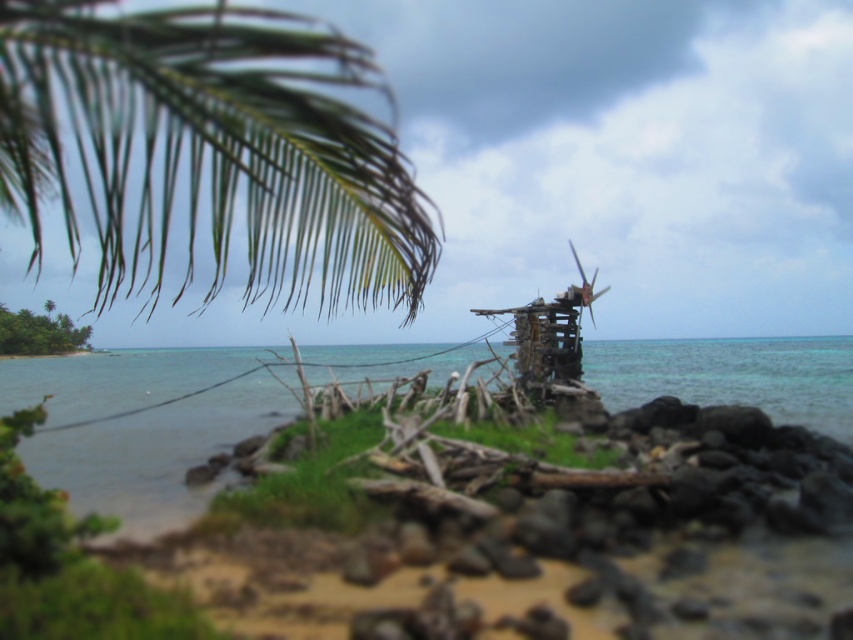
Question: Is green leafy palm at upper left in front of clear blue water at center?

Choices:
 (A) no
 (B) yes

Answer: (B)

Question: Can you confirm if green leafy palm at upper left is positioned above clear blue water at center?

Choices:
 (A) no
 (B) yes

Answer: (B)

Question: Which of the following is the closest to the observer?

Choices:
 (A) (142, 490)
 (B) (320, 76)

Answer: (B)

Question: Which point is farther to the camera?

Choices:
 (A) green leafy palm at upper left
 (B) clear blue water at center

Answer: (B)

Question: Can you confirm if green leafy palm at upper left is bigger than clear blue water at center?

Choices:
 (A) no
 (B) yes

Answer: (A)